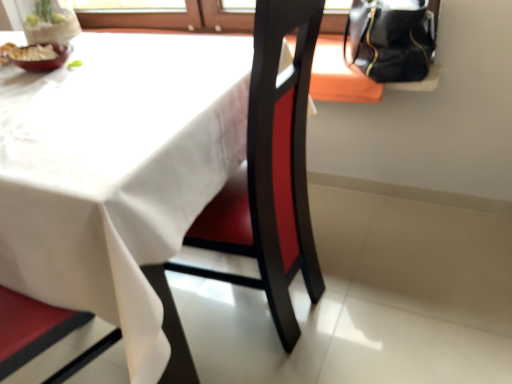
Looking at this image, what is the approximate height of matte ceramic bowl at upper left?

It is 2.37 inches.

What do you see at coordinates (391, 39) in the screenshot? I see `black leather handbag at upper right` at bounding box center [391, 39].

What are the coordinates of `white matte table at center` in the screenshot? It's located at (117, 172).

The width and height of the screenshot is (512, 384). Find the location of `matte ceramic bowl at upper left`. matte ceramic bowl at upper left is located at coordinates (45, 60).

How much distance is there between matte ceramic bowl at upper left and white matte table at center?

A distance of 17.51 inches exists between matte ceramic bowl at upper left and white matte table at center.

From the image's perspective, is matte ceramic bowl at upper left above or below white matte table at center?

From the image's perspective, matte ceramic bowl at upper left appears above white matte table at center.

Does point (53, 68) appear closer or farther from the camera than point (106, 282)?

Point (53, 68) appears to be farther away from the viewer than point (106, 282).

How different are the orientations of white matte table at center and matte ceramic bowl at upper left in degrees?

0.257 degrees.

Who is shorter, white matte table at center or matte ceramic bowl at upper left?

Standing shorter between the two is matte ceramic bowl at upper left.

Is white matte table at center positioned far away from matte ceramic bowl at upper left?

No, white matte table at center is not far from matte ceramic bowl at upper left.

Is matte ceramic bowl at upper left looking in the opposite direction of black leather handbag at upper right?

No, matte ceramic bowl at upper left is not facing the opposite direction of black leather handbag at upper right.

From the image's perspective, is matte ceramic bowl at upper left on top of black leather handbag at upper right?

Actually, matte ceramic bowl at upper left appears below black leather handbag at upper right in the image.

Is matte ceramic bowl at upper left touching black leather handbag at upper right?

matte ceramic bowl at upper left is not next to black leather handbag at upper right, and they're not touching.

Is matte ceramic bowl at upper left located outside black leather handbag at upper right?

Yes, matte ceramic bowl at upper left is located beyond the bounds of black leather handbag at upper right.

Visually, is black leather handbag at upper right positioned to the left or to the right of matte ceramic bowl at upper left?

In the image, black leather handbag at upper right appears on the right side of matte ceramic bowl at upper left.

How much distance is there between black leather handbag at upper right and matte ceramic bowl at upper left?

black leather handbag at upper right and matte ceramic bowl at upper left are 38.95 inches apart.

Is black leather handbag at upper right turned away from matte ceramic bowl at upper left?

No, matte ceramic bowl at upper left is not at the back of black leather handbag at upper right.

Considering the sizes of black leather handbag at upper right and matte ceramic bowl at upper left in the image, is black leather handbag at upper right bigger or smaller than matte ceramic bowl at upper left?

Considering their sizes, black leather handbag at upper right takes up more space than matte ceramic bowl at upper left.

Would you say black leather handbag at upper right is inside or outside white matte table at center?

black leather handbag at upper right lies outside white matte table at center.

Which object is further away from the camera, black leather handbag at upper right or white matte table at center?

Positioned behind is black leather handbag at upper right.

Could you tell me if black leather handbag at upper right is turned towards white matte table at center?

No, black leather handbag at upper right is not turned towards white matte table at center.

What's the angular difference between black leather handbag at upper right and white matte table at center's facing directions?

They differ by 0.765 degrees in their facing directions.

Between white matte table at center and black leather handbag at upper right, which one has smaller width?

black leather handbag at upper right.

Is white matte table at center taller or shorter than black leather handbag at upper right?

In the image, white matte table at center appears to be taller than black leather handbag at upper right.

Locate an element on the screen. handbag that is above the white matte table at center (from the image's perspective) is located at coordinates click(391, 39).

How different are the orientations of white matte table at center and black leather handbag at upper right in degrees?

The facing directions of white matte table at center and black leather handbag at upper right are 0.765 degrees apart.

Locate an element on the screen. Image resolution: width=512 pixels, height=384 pixels. tableware above the white matte table at center (from a real-world perspective) is located at coordinates (45, 60).

Locate an element on the screen. This screenshot has height=384, width=512. tableware above the white matte table at center (from the image's perspective) is located at coordinates (45, 60).

Looking at the image, which one is located further to matte ceramic bowl at upper left, white matte table at center or black leather handbag at upper right?

black leather handbag at upper right is further to matte ceramic bowl at upper left.

Looking at this image, which object lies further to the anchor point white matte table at center, matte ceramic bowl at upper left or black leather handbag at upper right?

The object further to white matte table at center is black leather handbag at upper right.

Looking at the image, which one is located further to black leather handbag at upper right, white matte table at center or matte ceramic bowl at upper left?

matte ceramic bowl at upper left is further to black leather handbag at upper right.

Estimate the real-world distances between objects in this image. Which object is further from black leather handbag at upper right, matte ceramic bowl at upper left or white matte table at center?

The object further to black leather handbag at upper right is matte ceramic bowl at upper left.

From the image, which object appears to be nearer to white matte table at center, black leather handbag at upper right or matte ceramic bowl at upper left?

Based on the image, matte ceramic bowl at upper left appears to be nearer to white matte table at center.

Estimate the real-world distances between objects in this image. Which object is closer to matte ceramic bowl at upper left, black leather handbag at upper right or white matte table at center?

Among the two, white matte table at center is located nearer to matte ceramic bowl at upper left.

Identify the location of tableware located between white matte table at center and black leather handbag at upper right in the left-right direction. Image resolution: width=512 pixels, height=384 pixels. (45, 60).